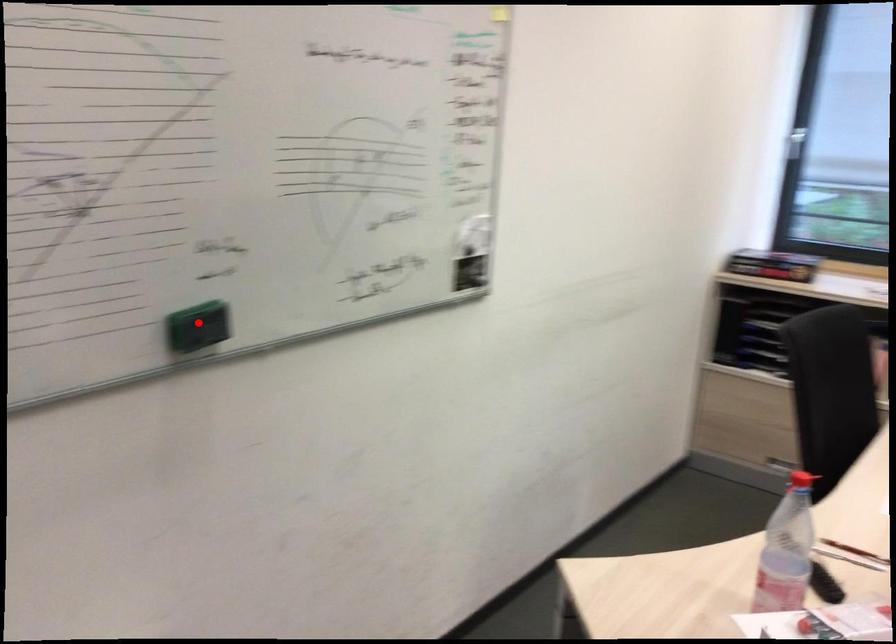
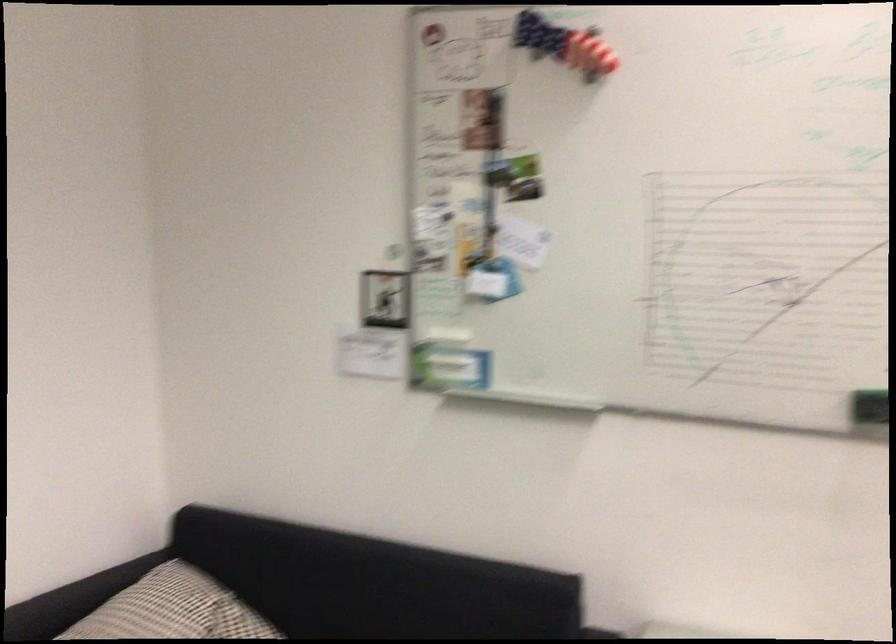
Question: A red point is marked in image1. In image2, is the corresponding 3D point closer to the camera or farther? Reply with the corresponding letter.

Choices:
 (A) The corresponding 3D point is closer.
 (B) The corresponding 3D point is farther.

Answer: (B)